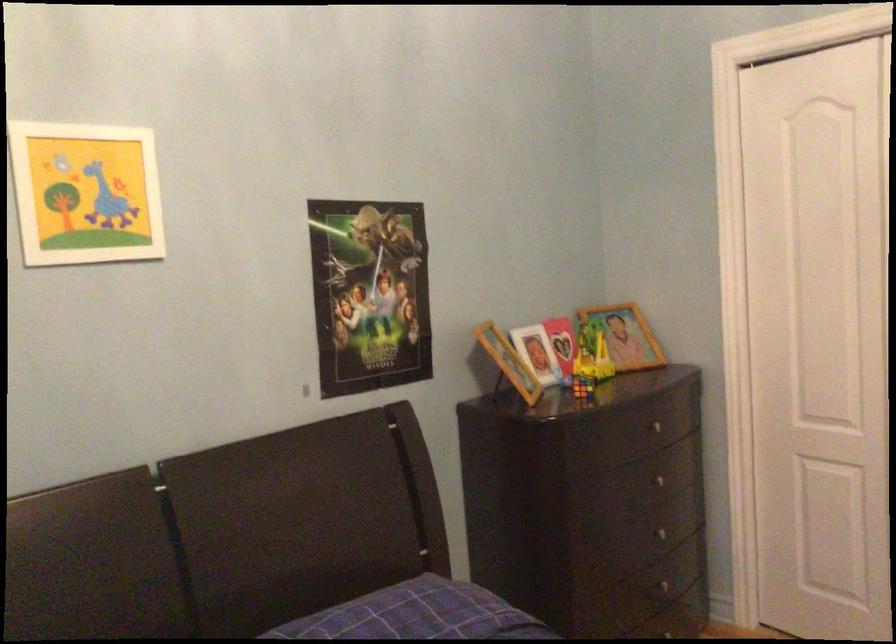
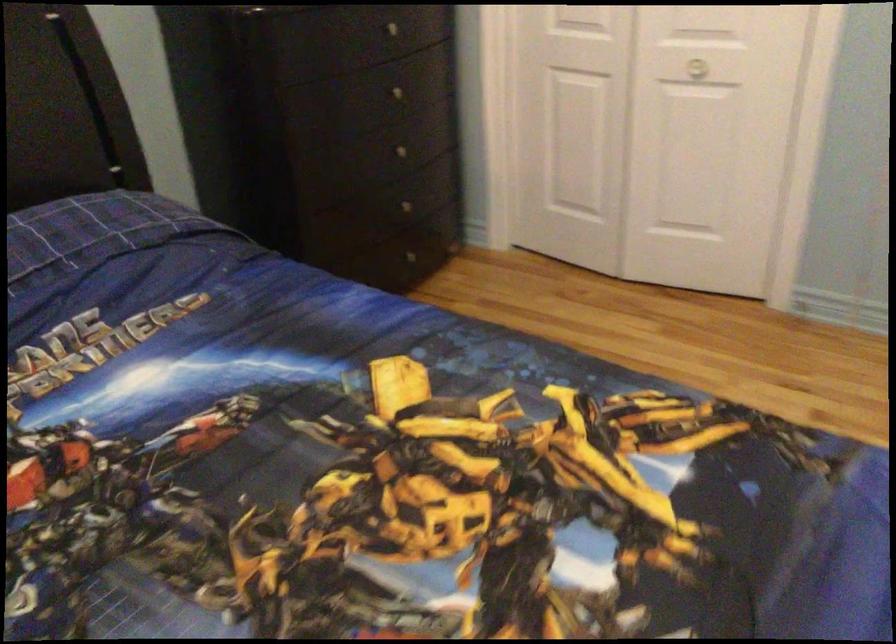
Question: In a continuous first-person perspective shot, in which direction is the camera moving?

Choices:
 (A) Left
 (B) Right
 (C) Forward
 (D) Backward

Answer: (B)